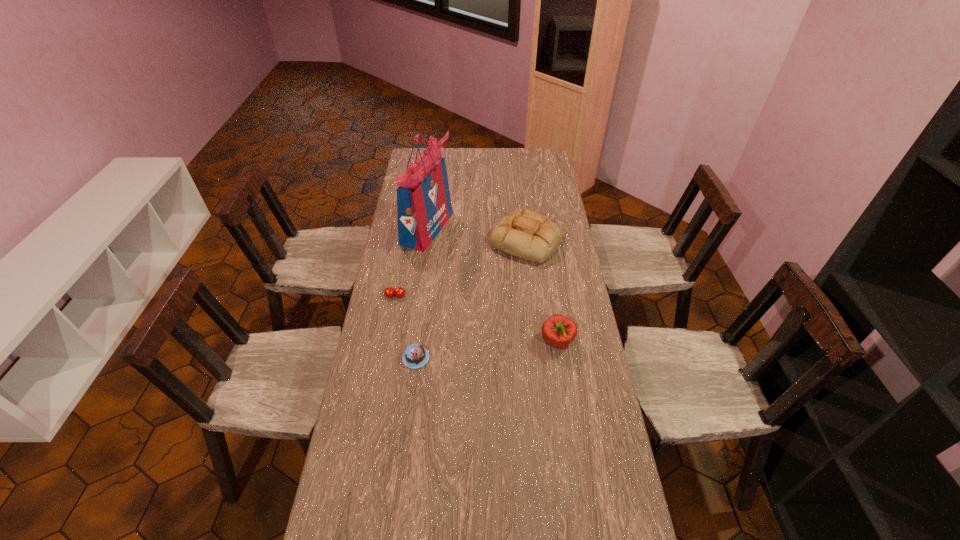
I want to click on grocery bag that is at the left edge, so click(x=424, y=206).

Where is `cherry at the left edge`? This screenshot has width=960, height=540. cherry at the left edge is located at coordinates (389, 292).

Locate an element on the screen. chocolate cake that is at the left edge is located at coordinates (415, 356).

Where is `bread that is at the right edge`? The width and height of the screenshot is (960, 540). bread that is at the right edge is located at coordinates (526, 234).

At what (x,y) coordinates should I click in order to perform the action: click on bell pepper situated at the right edge. Please return your answer as a coordinate pair (x, y). Image resolution: width=960 pixels, height=540 pixels. Looking at the image, I should click on (559, 331).

Find the location of a particular element. This screenshot has width=960, height=540. vacant space at the far edge of the desktop is located at coordinates (450, 161).

Where is `free space at the left edge`? The width and height of the screenshot is (960, 540). free space at the left edge is located at coordinates (396, 249).

Identify the location of free space at the right edge. (589, 375).

The width and height of the screenshot is (960, 540). In the image, there is a desktop. Find the location of `vacant space at the far left corner`. vacant space at the far left corner is located at coordinates (411, 147).

I want to click on free space between the bell pepper and the tallest object, so click(x=492, y=285).